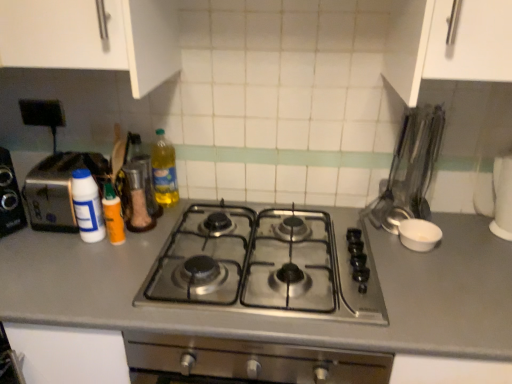
Where is `free space to the left of white plastic bottle at left, placed as the first bottle when sorted from left to right`? free space to the left of white plastic bottle at left, placed as the first bottle when sorted from left to right is located at coordinates (38, 240).